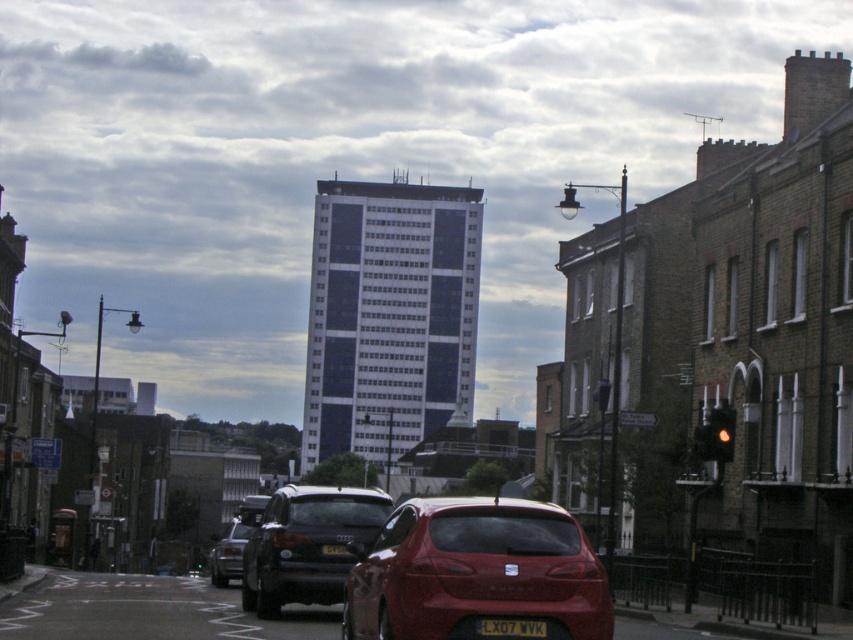
You are a pedestrian standing at the crosswalk and want to cross the street. There is a shiny red hatchback at center and a yellow glass traffic light at right. Which object is closer to you?

The shiny red hatchback at center is closer to you since it has a smaller size compared to the yellow glass traffic light at right, which indicates it is farther away.

You are a delivery driver who needs to park your vehicle in the parking bay closest to the traffic light. The traffic light is on the right side of the image. According to the scene, where should you position your vehicle relative to the shiny red hatchback at center?

The shiny red hatchback at center is positioned at coordinates point [476,572]. Since the traffic light is on the right side of the image, you should park your vehicle to the right of the shiny red hatchback at center to be closest to the traffic light.

You are a parking attendant checking license plates. You see a black plastic license plate at center and a yellow matte license plate at center. Which license plate could potentially block the other from being scanned by the camera if placed closer to the camera?

The black plastic license plate at center might be wider than yellow matte license plate at center, so if placed closer to the camera, it could potentially block the yellow matte license plate at center from being scanned.